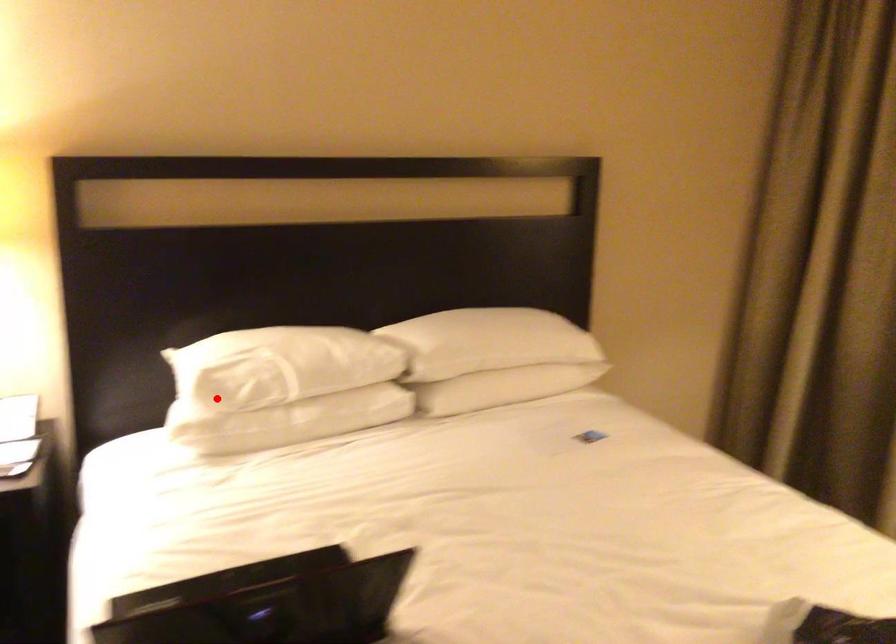
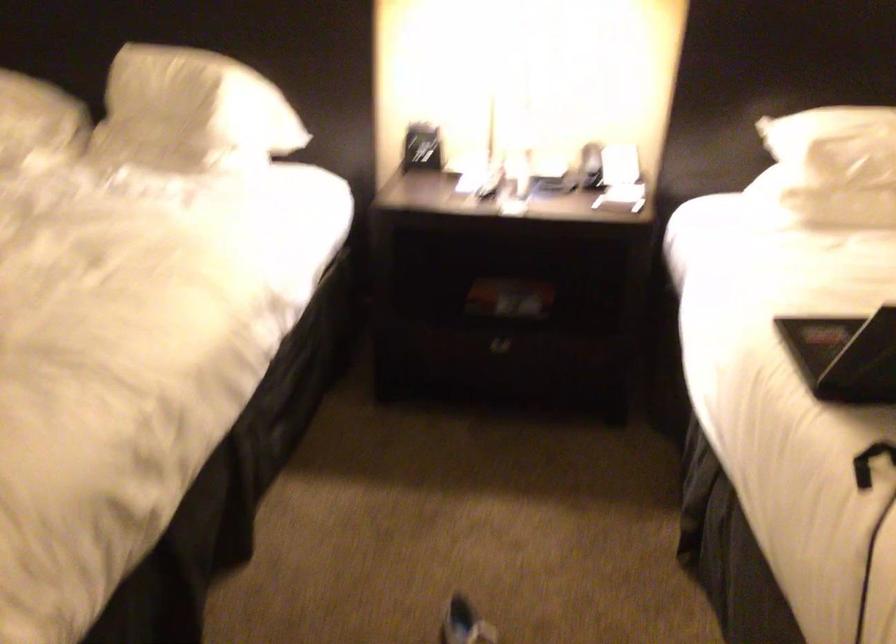
Find the pixel in the second image that matches the highlighted location in the first image.

(831, 167)